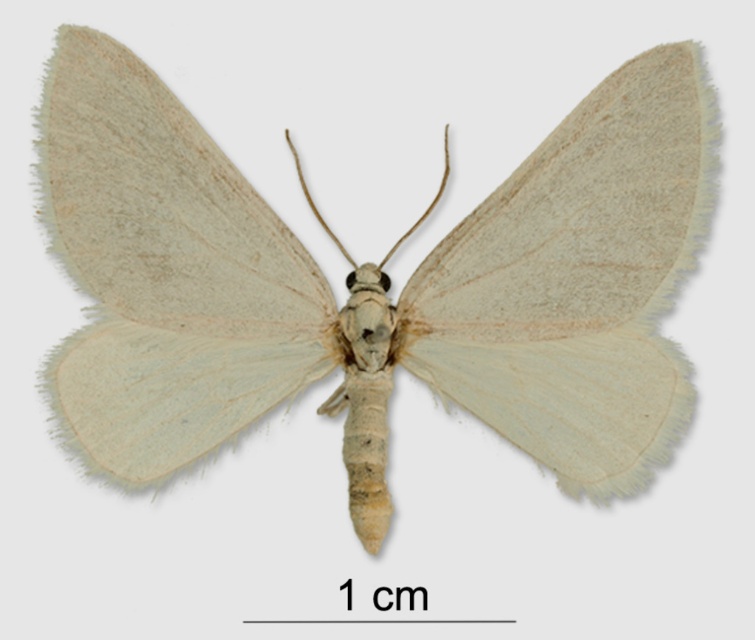
You are a researcher examining a moth specimen. You notice two points marked on the image at coordinates point (399,296) and point (279,256). Which point is closer to the camera?

Point (279,256) is closer to the camera because it is less further than point (399,296).

You are an entomologist examining a moth specimen. You notice the light green fuzzy moth at center and the light green fringed moth wing at center. Which of these has a greater height?

The light green fuzzy moth at center has a greater height compared to the light green fringed moth wing at center.